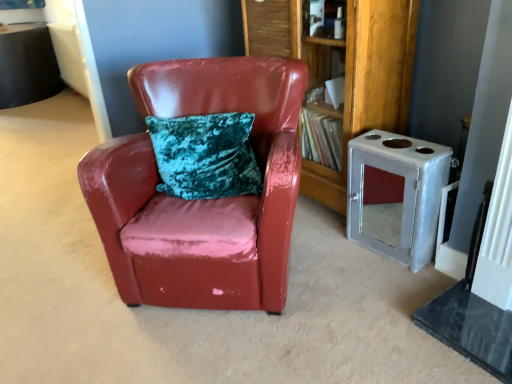
Question: Can you confirm if glossy leather chair at center is wider than wooden bookshelf at center?

Choices:
 (A) yes
 (B) no

Answer: (A)

Question: Can you confirm if glossy leather chair at center is smaller than wooden bookshelf at center?

Choices:
 (A) no
 (B) yes

Answer: (A)

Question: From the image's perspective, is glossy leather chair at center located beneath wooden bookshelf at center?

Choices:
 (A) no
 (B) yes

Answer: (B)

Question: Does glossy leather chair at center appear on the left side of wooden bookshelf at center?

Choices:
 (A) no
 (B) yes

Answer: (B)

Question: From the image's perspective, is glossy leather chair at center above wooden bookshelf at center?

Choices:
 (A) no
 (B) yes

Answer: (A)

Question: Is glossy leather chair at center facing towards wooden bookshelf at center?

Choices:
 (A) no
 (B) yes

Answer: (A)

Question: From the image's perspective, is metallic silver cabinet at right over wooden bookshelf at center?

Choices:
 (A) no
 (B) yes

Answer: (A)

Question: Is metallic silver cabinet at right aimed at wooden bookshelf at center?

Choices:
 (A) no
 (B) yes

Answer: (A)

Question: Does metallic silver cabinet at right appear on the left side of wooden bookshelf at center?

Choices:
 (A) no
 (B) yes

Answer: (A)

Question: Is wooden bookshelf at center located within metallic silver cabinet at right?

Choices:
 (A) yes
 (B) no

Answer: (B)

Question: Is metallic silver cabinet at right next to wooden bookshelf at center?

Choices:
 (A) no
 (B) yes

Answer: (A)

Question: Considering the relative sizes of metallic silver cabinet at right and wooden bookshelf at center in the image provided, is metallic silver cabinet at right wider than wooden bookshelf at center?

Choices:
 (A) yes
 (B) no

Answer: (B)

Question: Does wooden bookshelf at center turn towards glossy leather chair at center?

Choices:
 (A) yes
 (B) no

Answer: (A)